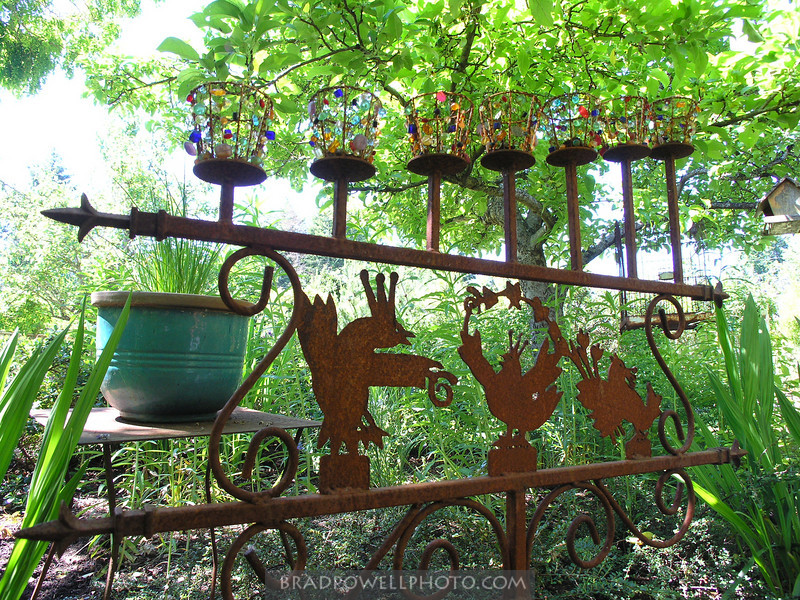
Find the location of `potted plant`. potted plant is located at coordinates (176, 284).